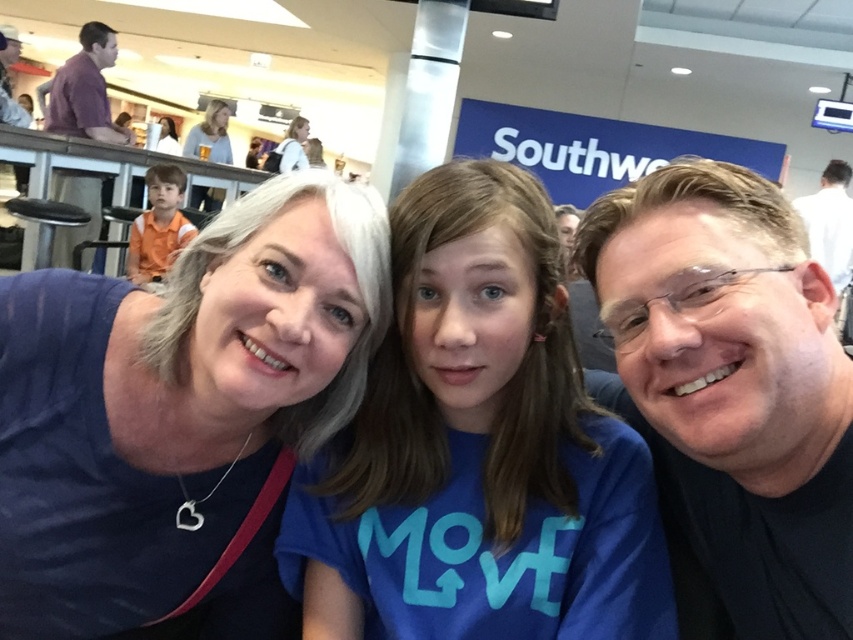
Does point (296, 506) come farther from viewer compared to point (212, 202)?

That is False.

Is blue cotton shirt at center to the right of matte white hair at upper center from the viewer's perspective?

Indeed, blue cotton shirt at center is positioned on the right side of matte white hair at upper center.

What do you see at coordinates (480, 445) in the screenshot? I see `blue cotton shirt at center` at bounding box center [480, 445].

Identify the location of blue cotton shirt at center. This screenshot has height=640, width=853. (480, 445).

Who is more forward, (686,170) or (78,124)?

Point (686,170)

Between matte black shirt at center and purple shirt at upper left, which one appears on the right side from the viewer's perspective?

matte black shirt at center is more to the right.

Identify the location of matte black shirt at center. This screenshot has width=853, height=640. (730, 394).

You are a GUI agent. You are given a task and a screenshot of the screen. Output one action in this format:
    pyautogui.click(x=<x>, y=<y>)
    Task: Click on the matte black shirt at center
    
    Given the screenshot: What is the action you would take?
    pyautogui.click(x=730, y=394)

Which is below, purple shirt at upper left or white fabric at upper center?

purple shirt at upper left

Is purple shirt at upper left to the left of white fabric at upper center from the viewer's perspective?

In fact, purple shirt at upper left is to the right of white fabric at upper center.

Locate an element on the screen. purple shirt at upper left is located at coordinates tap(85, 90).

Identify the location of purple shirt at upper left. The image size is (853, 640). (85, 90).